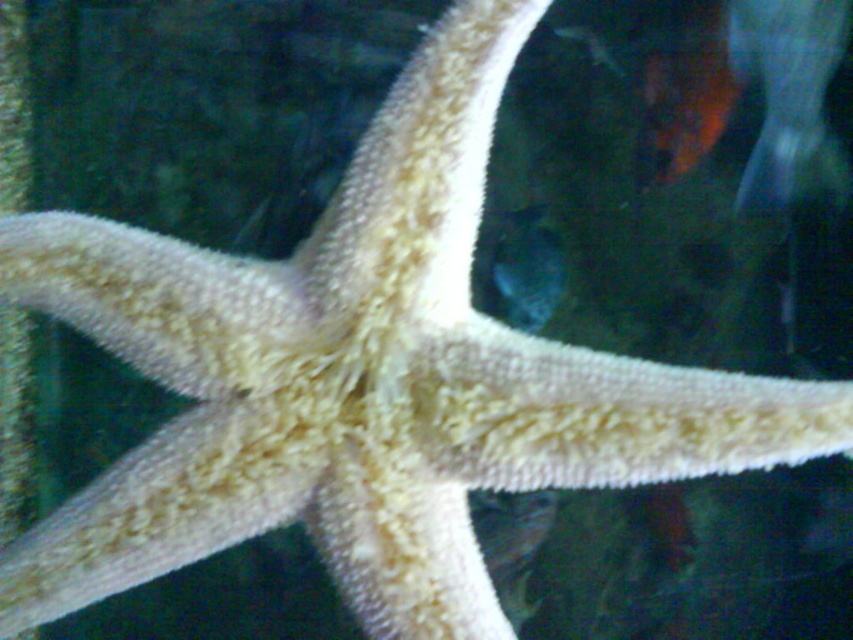
From the picture: Which of these two, orange matte goldfish at upper right or shiny silver fish at upper center, stands taller?

Standing taller between the two is orange matte goldfish at upper right.

Which is above, orange matte goldfish at upper right or shiny silver fish at upper center?

shiny silver fish at upper center

The height and width of the screenshot is (640, 853). What do you see at coordinates (685, 92) in the screenshot?
I see `orange matte goldfish at upper right` at bounding box center [685, 92].

This screenshot has height=640, width=853. What are the coordinates of `orange matte goldfish at upper right` in the screenshot? It's located at (685, 92).